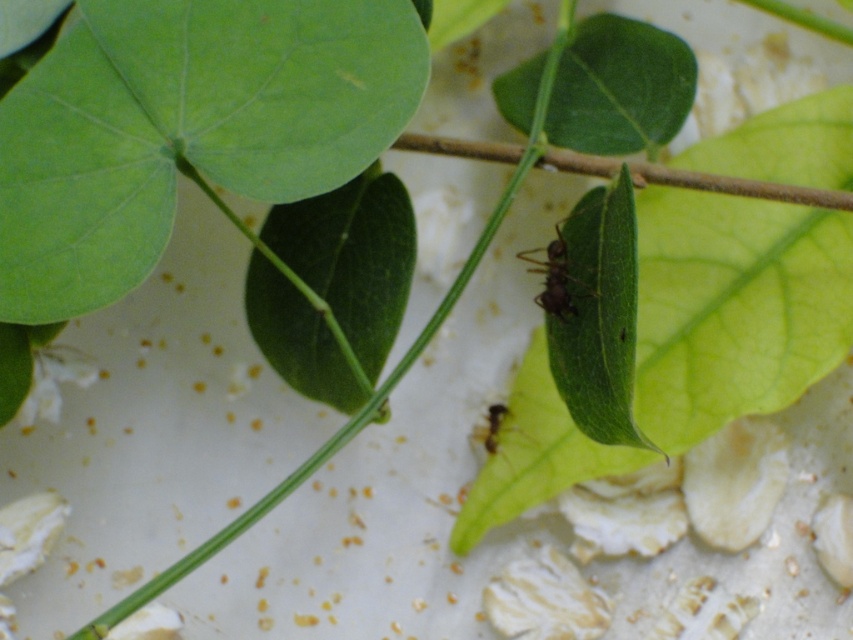
You are a tiny insect explorer on the leaf. You see two ants, the brown matte ant at center and the green matte ant at center. Which ant is closer to you?

The brown matte ant at center is closer to you because it is in front of the green matte ant at center.